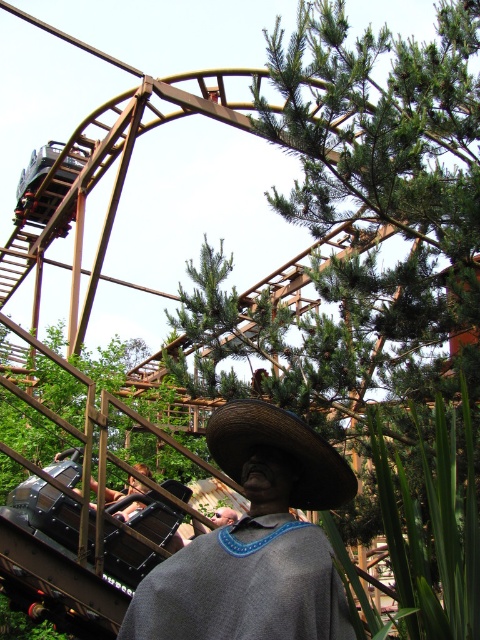
You are a visitor at the amusement park and notice two headgear items in the image. Which one is smaller between the woven straw cowboy hat at center and the metallic silver helmet at lower center?

The woven straw cowboy hat at center is smaller than the metallic silver helmet at lower center.

You are standing at the roller coaster in the amusement park and see two points marked in the image. Which of the two points, point (249, 563) or point (122, 516), is closer to you?

Point (249, 563) is closer to you because it is in front of point (122, 516).